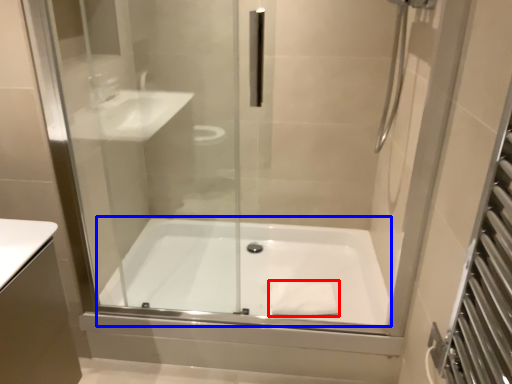
Question: Among these objects, which one is farthest to the camera, material (highlighted by a red box) or bathtub (highlighted by a blue box)?

Choices:
 (A) material
 (B) bathtub

Answer: (A)